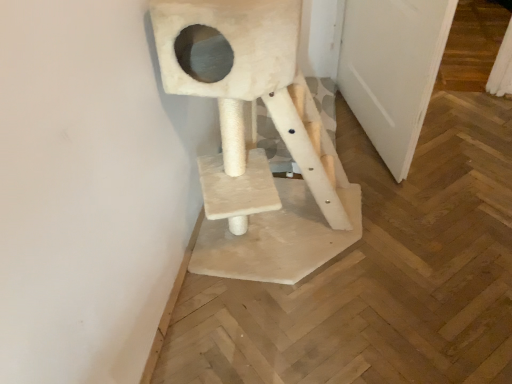
Where is `space that is in front of sanded wood cat tree at center`? The image size is (512, 384). space that is in front of sanded wood cat tree at center is located at coordinates (298, 331).